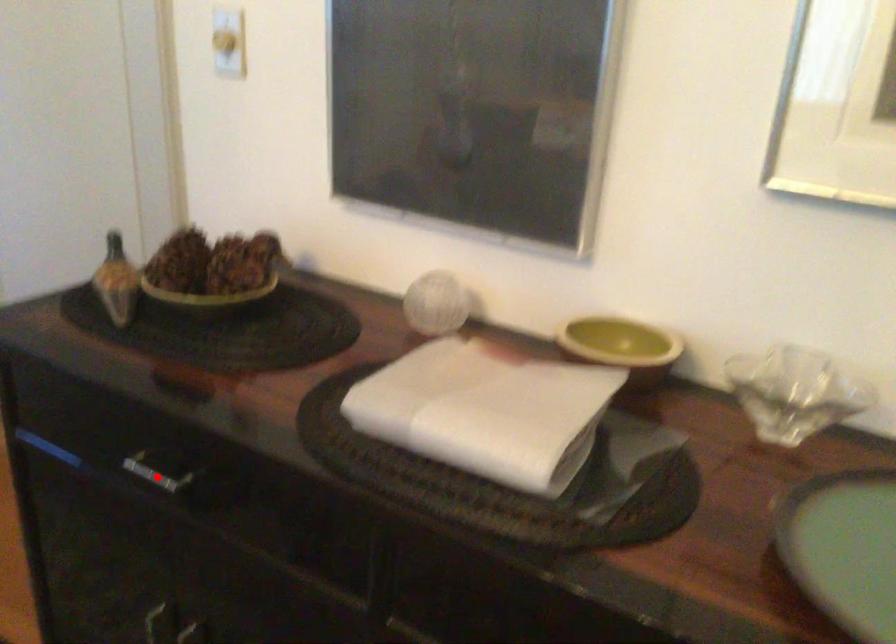
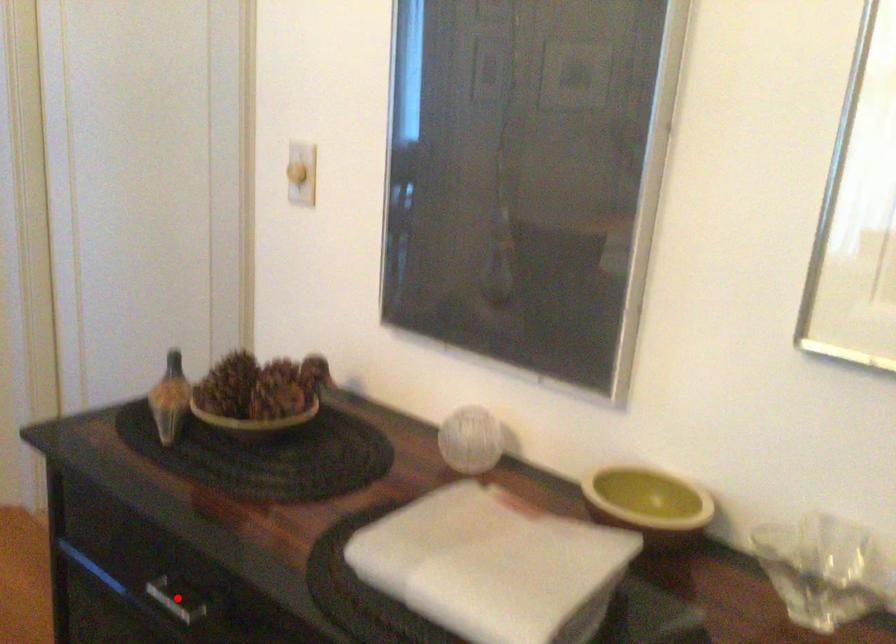
I am providing you with two images of the same scene from different viewpoints. A red point is marked on the first image and another point is marked on the second image. Do the highlighted points in image1 and image2 indicate the same real-world spot?

Yes